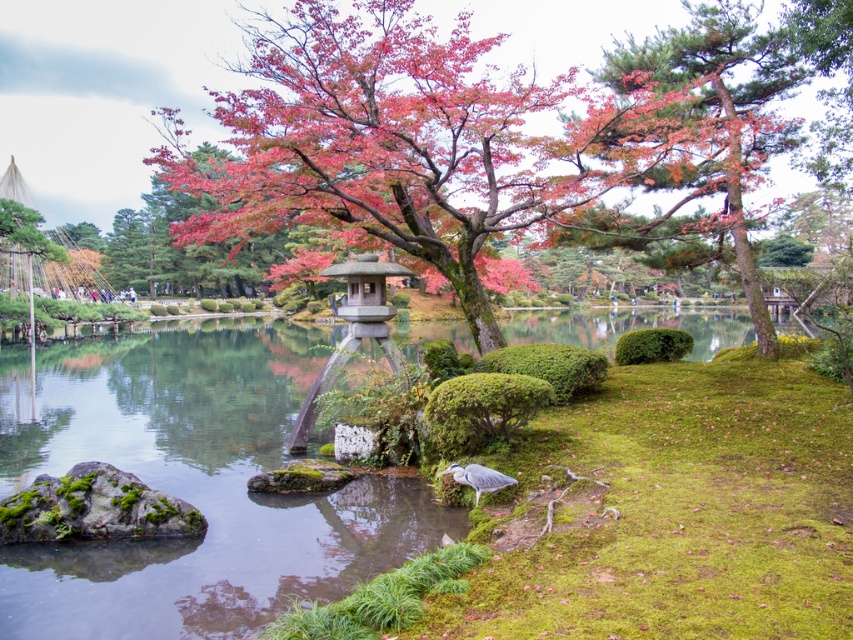
Is point (624, 150) farther from viewer compared to point (381, 314)?

No, it is not.

Does shiny pink leaves at center appear on the left side of stone lantern at center?

Yes, shiny pink leaves at center is to the left of stone lantern at center.

The width and height of the screenshot is (853, 640). Find the location of `shiny pink leaves at center`. shiny pink leaves at center is located at coordinates (473, 144).

Where is `shiny pink leaves at center`? Image resolution: width=853 pixels, height=640 pixels. shiny pink leaves at center is located at coordinates (473, 144).

Which is more to the left, shiny pink leaves at center or pine tree at upper right?

From the viewer's perspective, shiny pink leaves at center appears more on the left side.

Is shiny pink leaves at center bigger than pine tree at upper right?

Indeed, shiny pink leaves at center has a larger size compared to pine tree at upper right.

Does point (579, 115) come behind point (729, 182)?

That is True.

The width and height of the screenshot is (853, 640). In order to click on shiny pink leaves at center in this screenshot , I will do `click(473, 144)`.

Which is in front, point (740, 164) or point (334, 264)?

Point (740, 164)

Is pine tree at upper right closer to camera compared to stone lantern at center?

Yes.

Locate an element on the screen. pine tree at upper right is located at coordinates (722, 108).

You are a GUI agent. You are given a task and a screenshot of the screen. Output one action in this format:
    pyautogui.click(x=<x>, y=<y>)
    Task: Click on the pine tree at upper right
    
    Given the screenshot: What is the action you would take?
    pyautogui.click(x=722, y=108)